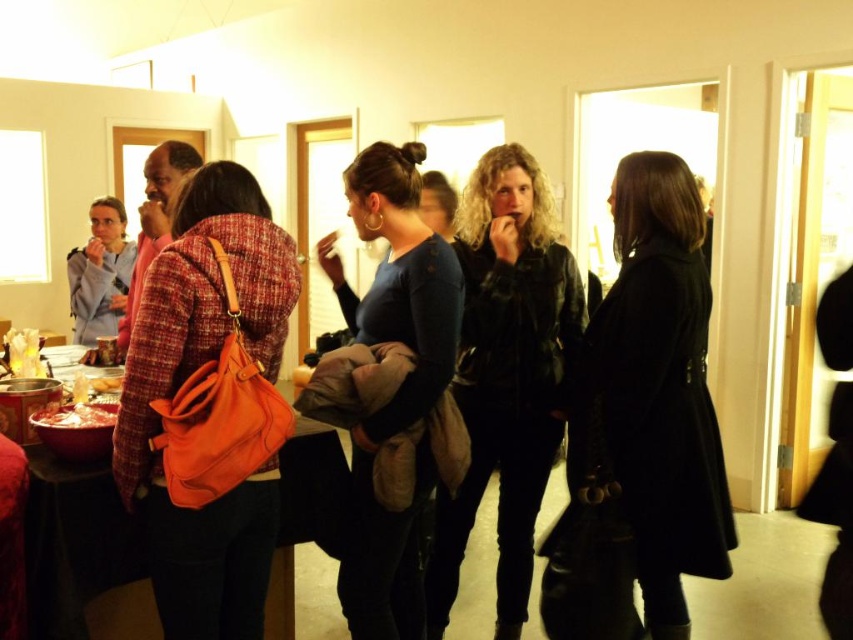
Question: Does leather jacket at center appear on the left side of orange leather bag at left?

Choices:
 (A) no
 (B) yes

Answer: (A)

Question: Which of the following is the closest to the observer?

Choices:
 (A) (695, 518)
 (B) (509, 336)
 (C) (44, 413)

Answer: (C)

Question: Which object appears farthest from the camera in this image?

Choices:
 (A) blue cotton sweater at center
 (B) orange leather bag at left
 (C) shiny metallic bowl at lower left
 (D) black leather coat at center

Answer: (D)

Question: Is orange leather bag at left to the left of shiny metallic bowl at lower left from the viewer's perspective?

Choices:
 (A) yes
 (B) no

Answer: (B)

Question: Does orange leather bag at left appear on the right side of blue cotton sweater at center?

Choices:
 (A) yes
 (B) no

Answer: (B)

Question: Which point appears farthest from the camera in this image?

Choices:
 (A) (664, 451)
 (B) (558, 369)
 (C) (402, 598)
 (D) (109, 419)

Answer: (B)